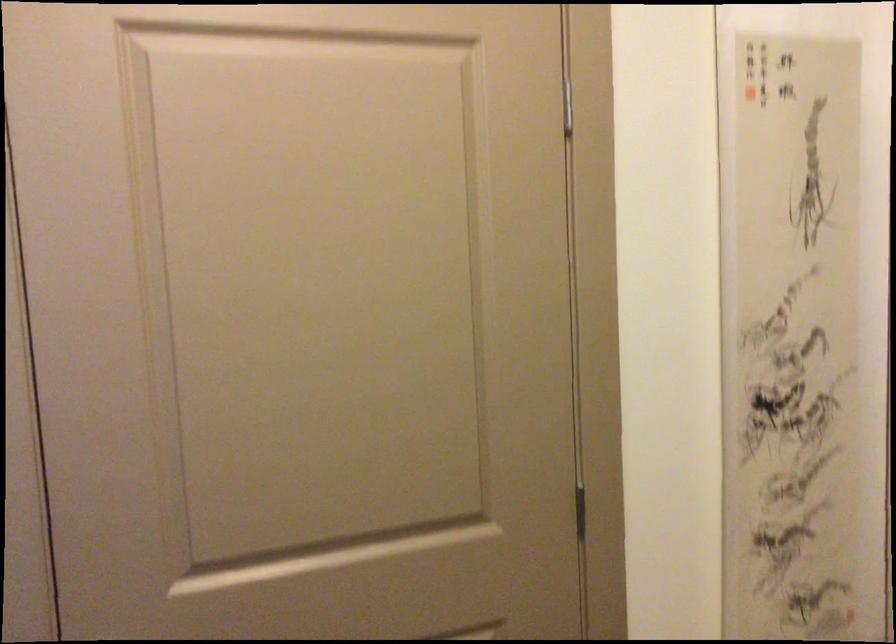
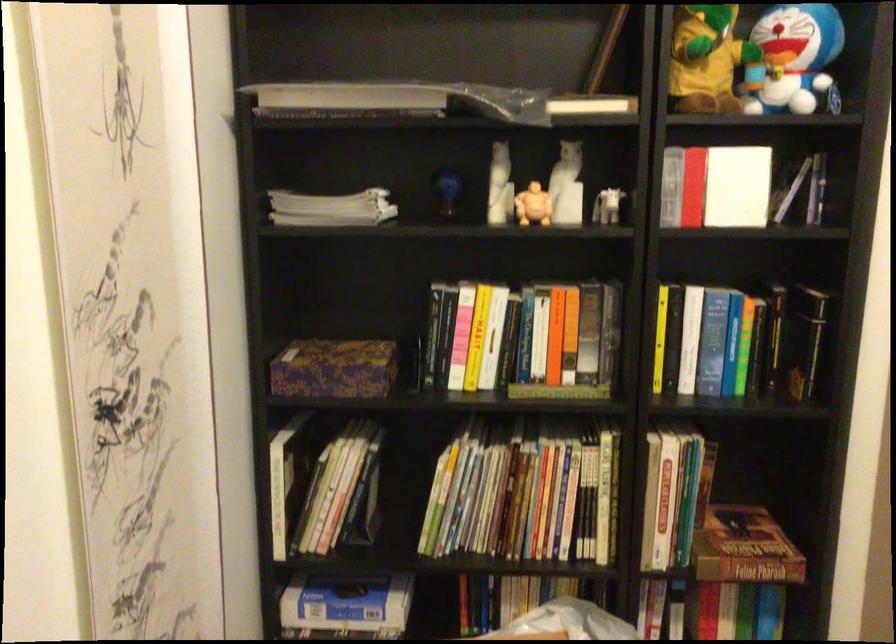
Question: The camera is either moving clockwise (left) or counter-clockwise (right) around the object. The first image is from the beginning of the video and the second image is from the end. Is the camera moving left or right when shooting the video?

Choices:
 (A) Left
 (B) Right

Answer: (A)